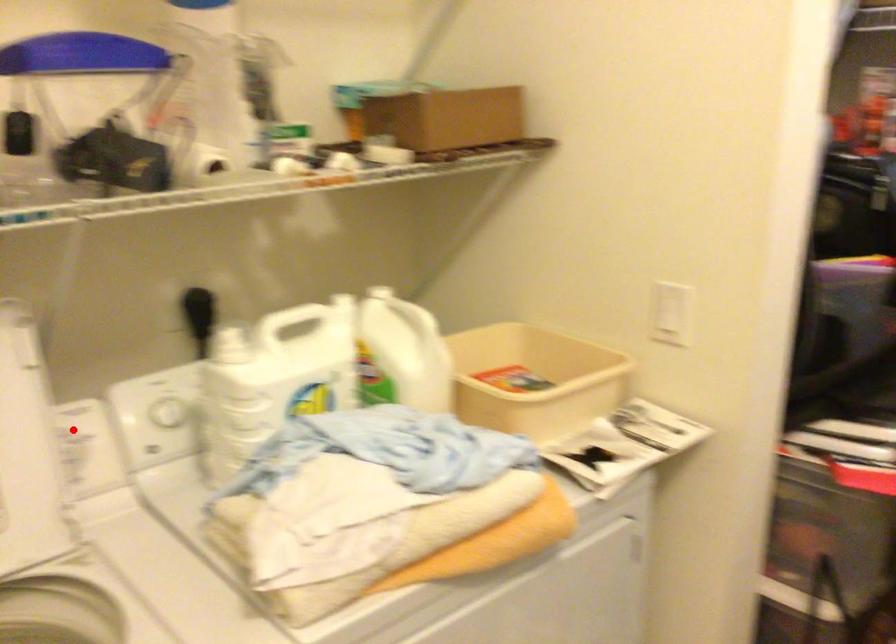
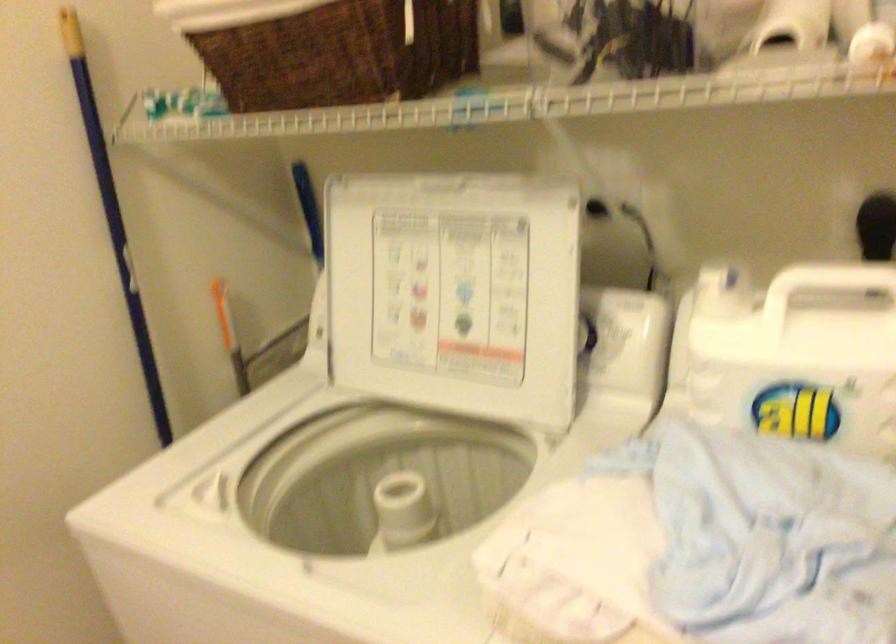
The point at the highlighted location is marked in the first image. Where is the corresponding point in the second image?

(616, 325)